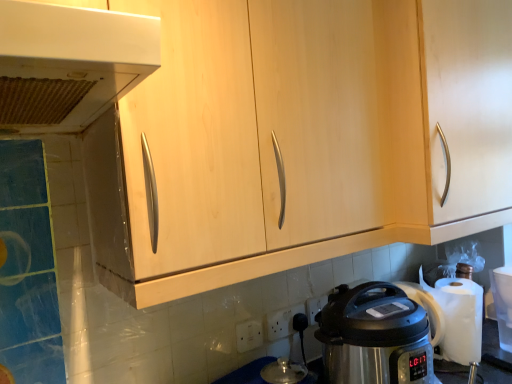
Describe the element at coordinates (68, 63) in the screenshot. I see `white plastic range hood at upper left` at that location.

Measure the distance between white plastic electric outlet at lower center, which is the second electric outlet in back-to-front order, and camera.

white plastic electric outlet at lower center, which is the second electric outlet in back-to-front order, and camera are 1.30 meters apart.

Where is `white plastic electric outlet at lower center, placed as the 1th electric outlet when sorted from back to front`? Image resolution: width=512 pixels, height=384 pixels. white plastic electric outlet at lower center, placed as the 1th electric outlet when sorted from back to front is located at coordinates (315, 307).

Measure the distance between stainless steel pressure cooker at lower right and camera.

stainless steel pressure cooker at lower right and camera are 38.10 inches apart.

Find the location of a particular element. light wood cabinet at center is located at coordinates (298, 138).

The height and width of the screenshot is (384, 512). I want to click on white plastic range hood at upper left, so pos(68,63).

What's the angular difference between white plastic electric outlet at lower center, which appears as the first electric outlet when viewed from the front, and white plastic electric outlet at lower center, marked as the third electric outlet in a left-to-right arrangement,'s facing directions?

0.00159 degrees separate the facing orientations of white plastic electric outlet at lower center, which appears as the first electric outlet when viewed from the front, and white plastic electric outlet at lower center, marked as the third electric outlet in a left-to-right arrangement.

Considering the sizes of white plastic electric outlet at lower center, the third electric outlet from the back, and white plastic electric outlet at lower center, placed as the 1th electric outlet when sorted from back to front, in the image, is white plastic electric outlet at lower center, the third electric outlet from the back, wider or thinner than white plastic electric outlet at lower center, placed as the 1th electric outlet when sorted from back to front,?

Clearly, white plastic electric outlet at lower center, the third electric outlet from the back, has more width compared to white plastic electric outlet at lower center, placed as the 1th electric outlet when sorted from back to front.

Can you confirm if white plastic electric outlet at lower center, the third electric outlet from the back, is positioned to the right of white plastic electric outlet at lower center, placed as the 1th electric outlet when sorted from back to front?

No, white plastic electric outlet at lower center, the third electric outlet from the back, is not to the right of white plastic electric outlet at lower center, placed as the 1th electric outlet when sorted from back to front.

Is white plastic electric outlet at lower center, placed as the 1th electric outlet when sorted from back to front, at the back of white plastic electric outlet at lower center, which appears as the first electric outlet when viewed from the front?

That's not correct — white plastic electric outlet at lower center, which appears as the first electric outlet when viewed from the front, is not looking away from white plastic electric outlet at lower center, placed as the 1th electric outlet when sorted from back to front.

Between point (290, 325) and point (259, 336), which one is positioned behind?

The point (290, 325) is farther.

Looking at their sizes, would you say white plastic electric outlet at lower center, which is the second electric outlet in back-to-front order, is wider or thinner than white plastic electric outlet at lower center, acting as the third electric outlet starting from the right?

In the image, white plastic electric outlet at lower center, which is the second electric outlet in back-to-front order, appears to be more narrow than white plastic electric outlet at lower center, acting as the third electric outlet starting from the right.

Identify the location of electric outlet in front of the white plastic electric outlet at lower center, which is the second electric outlet in back-to-front order. The image size is (512, 384). [x=249, y=335].

From a real-world perspective, relative to white plastic electric outlet at lower center, the 1th electric outlet positioned from the left, is white plastic electric outlet at lower center, which is the 2th electric outlet from front to back, vertically above or below?

From a real-world perspective, white plastic electric outlet at lower center, which is the 2th electric outlet from front to back, is physically above white plastic electric outlet at lower center, the 1th electric outlet positioned from the left.

Considering the sizes of objects white plastic range hood at upper left and white plastic electric outlet at lower center, the 1th electric outlet positioned from the left, in the image provided, who is smaller, white plastic range hood at upper left or white plastic electric outlet at lower center, the 1th electric outlet positioned from the left,?

white plastic electric outlet at lower center, the 1th electric outlet positioned from the left.

Between white plastic range hood at upper left and white plastic electric outlet at lower center, the third electric outlet from the back, which one appears on the left side from the viewer's perspective?

white plastic range hood at upper left is more to the left.

Would you say white plastic range hood at upper left is a long distance from white plastic electric outlet at lower center, the third electric outlet from the back?

white plastic range hood at upper left is near white plastic electric outlet at lower center, the third electric outlet from the back, not far away.

Would you say stainless steel pressure cooker at lower right is part of white plastic range hood at upper left's contents?

No, stainless steel pressure cooker at lower right is not surrounded by white plastic range hood at upper left.

Is white plastic range hood at upper left with stainless steel pressure cooker at lower right?

No.

Which of these two, white plastic range hood at upper left or stainless steel pressure cooker at lower right, is wider?

With larger width is white plastic range hood at upper left.

From a real-world perspective, is white plastic range hood at upper left above or below stainless steel pressure cooker at lower right?

white plastic range hood at upper left is situated higher than stainless steel pressure cooker at lower right in the real world.

From a real-world perspective, is stainless steel pressure cooker at lower right physically below light wood cabinet at center?

Correct, in the physical world, stainless steel pressure cooker at lower right is lower than light wood cabinet at center.

I want to click on cabinetry located on the left of stainless steel pressure cooker at lower right, so click(298, 138).

Is stainless steel pressure cooker at lower right facing away from light wood cabinet at center?

stainless steel pressure cooker at lower right is not turned away from light wood cabinet at center.

Is stainless steel pressure cooker at lower right next to light wood cabinet at center?

No, stainless steel pressure cooker at lower right is not beside light wood cabinet at center.

Is white plastic electric outlet at lower center, acting as the third electric outlet starting from the right, positioned behind light wood cabinet at center?

Yes, white plastic electric outlet at lower center, acting as the third electric outlet starting from the right, is further from the viewer.

Considering the sizes of objects white plastic electric outlet at lower center, the third electric outlet from the back, and light wood cabinet at center in the image provided, who is bigger, white plastic electric outlet at lower center, the third electric outlet from the back, or light wood cabinet at center?

With larger size is light wood cabinet at center.

Does white plastic electric outlet at lower center, the third electric outlet from the back, appear on the left side of light wood cabinet at center?

Incorrect, white plastic electric outlet at lower center, the third electric outlet from the back, is not on the left side of light wood cabinet at center.

Is white plastic electric outlet at lower center, which appears as the first electric outlet when viewed from the front, touching light wood cabinet at center?

No, white plastic electric outlet at lower center, which appears as the first electric outlet when viewed from the front, is not in contact with light wood cabinet at center.

Relative to white plastic electric outlet at lower center, which is the 2th electric outlet from front to back, is white plastic electric outlet at lower center, placed as the 1th electric outlet when sorted from back to front, in front or behind?

In the image, white plastic electric outlet at lower center, placed as the 1th electric outlet when sorted from back to front, appears behind white plastic electric outlet at lower center, which is the 2th electric outlet from front to back.

Is white plastic electric outlet at lower center, positioned as the 1th electric outlet in right-to-left order, outside of white plastic electric outlet at lower center, which is the 2th electric outlet from front to back?

Yes, white plastic electric outlet at lower center, positioned as the 1th electric outlet in right-to-left order, is not within white plastic electric outlet at lower center, which is the 2th electric outlet from front to back.

Consider the image. Can you confirm if white plastic electric outlet at lower center, which is the third electric outlet in front-to-back order, is bigger than white plastic electric outlet at lower center, which ranks as the second electric outlet in left-to-right order?

Yes.

Looking at this image, between white plastic electric outlet at lower center, marked as the third electric outlet in a left-to-right arrangement, and white plastic electric outlet at lower center, which is the 2th electric outlet from front to back, which one has less height?

With less height is white plastic electric outlet at lower center, which is the 2th electric outlet from front to back.

Find the location of a particular element. the 2nd electric outlet positioned below the white plastic electric outlet at lower center, placed as the 1th electric outlet when sorted from back to front (from the image's perspective) is located at coordinates (249, 335).

At what (x,y) coordinates should I click in order to perform the action: click on electric outlet that is the 1st object above the white plastic electric outlet at lower center, the third electric outlet from the back (from a real-world perspective). Please return your answer as a coordinate pair (x, y). This screenshot has height=384, width=512. Looking at the image, I should click on (278, 324).

Considering their positions, is stainless steel pressure cooker at lower right positioned closer to light wood cabinet at center than white plastic range hood at upper left?

Among the two, stainless steel pressure cooker at lower right is located nearer to light wood cabinet at center.

Which object lies further to the anchor point white plastic electric outlet at lower center, placed as the 1th electric outlet when sorted from back to front, white plastic electric outlet at lower center, which ranks as the second electric outlet in left-to-right order, or light wood cabinet at center?

light wood cabinet at center is further to white plastic electric outlet at lower center, placed as the 1th electric outlet when sorted from back to front.

Based on their spatial positions, is white plastic electric outlet at lower center, which appears as the first electric outlet when viewed from the front, or light wood cabinet at center closer to white plastic electric outlet at lower center, which is the 2th electric outlet from front to back?

white plastic electric outlet at lower center, which appears as the first electric outlet when viewed from the front, is closer to white plastic electric outlet at lower center, which is the 2th electric outlet from front to back.

Considering their positions, is stainless steel pressure cooker at lower right positioned closer to light wood cabinet at center than white plastic electric outlet at lower center, which is the second electric outlet in back-to-front order?

stainless steel pressure cooker at lower right is positioned closer to the anchor light wood cabinet at center.

Looking at the image, which one is located closer to light wood cabinet at center, white plastic electric outlet at lower center, placed as the 2th electric outlet when sorted from right to left, or white plastic electric outlet at lower center, which is the third electric outlet in front-to-back order?

Among the two, white plastic electric outlet at lower center, placed as the 2th electric outlet when sorted from right to left, is located nearer to light wood cabinet at center.

Looking at the image, which one is located further to white plastic electric outlet at lower center, the third electric outlet from the back, white plastic electric outlet at lower center, placed as the 1th electric outlet when sorted from back to front, or white plastic range hood at upper left?

white plastic range hood at upper left is positioned further to the anchor white plastic electric outlet at lower center, the third electric outlet from the back.

When comparing their distances from white plastic electric outlet at lower center, which is the third electric outlet in front-to-back order, does light wood cabinet at center or white plastic electric outlet at lower center, acting as the third electric outlet starting from the right, seem further?

light wood cabinet at center lies further to white plastic electric outlet at lower center, which is the third electric outlet in front-to-back order, than the other object.

In the scene shown: Which object lies nearer to the anchor point white plastic electric outlet at lower center, acting as the third electric outlet starting from the right, light wood cabinet at center or white plastic electric outlet at lower center, marked as the third electric outlet in a left-to-right arrangement?

white plastic electric outlet at lower center, marked as the third electric outlet in a left-to-right arrangement, is positioned closer to the anchor white plastic electric outlet at lower center, acting as the third electric outlet starting from the right.

Find the location of a particular element. The height and width of the screenshot is (384, 512). kitchen appliance between light wood cabinet at center and white plastic electric outlet at lower center, acting as the third electric outlet starting from the right, from top to bottom is located at coordinates (374, 336).

You are a GUI agent. You are given a task and a screenshot of the screen. Output one action in this format:
    pyautogui.click(x=<x>, y=<y>)
    Task: Click on the electric outlet between white plastic range hood at upper left and white plastic electric outlet at lower center, which is the 2th electric outlet from front to back, along the z-axis
    
    Given the screenshot: What is the action you would take?
    pyautogui.click(x=249, y=335)

Locate an element on the screen. kitchen appliance between light wood cabinet at center and white plastic electric outlet at lower center, marked as the third electric outlet in a left-to-right arrangement, in the front-back direction is located at coordinates (374, 336).

The height and width of the screenshot is (384, 512). I want to click on kitchen appliance between white plastic range hood at upper left and white plastic electric outlet at lower center, placed as the 1th electric outlet when sorted from back to front, in the front-back direction, so click(374, 336).